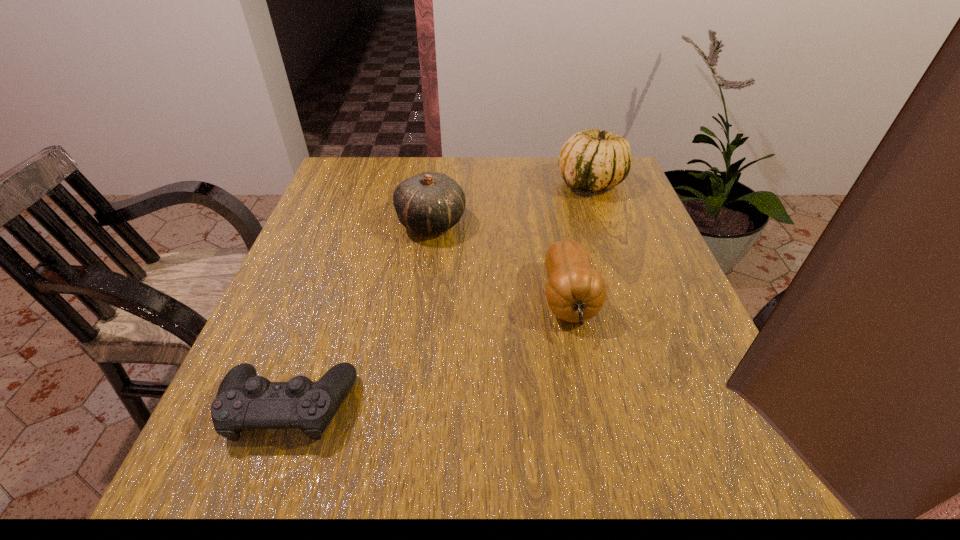
This screenshot has width=960, height=540. I want to click on the farthest object, so click(x=591, y=160).

Where is `the third nearest object`? The width and height of the screenshot is (960, 540). the third nearest object is located at coordinates (430, 202).

At what (x,y) coordinates should I click in order to perform the action: click on the third object from right to left. Please return your answer as a coordinate pair (x, y). Looking at the image, I should click on (430, 202).

Identify the location of the nearest gourd. The height and width of the screenshot is (540, 960). (575, 292).

Locate an element on the screen. This screenshot has height=540, width=960. the nearest object is located at coordinates (244, 400).

This screenshot has height=540, width=960. In order to click on the leftmost object in this screenshot , I will do tap(244, 400).

Image resolution: width=960 pixels, height=540 pixels. In order to click on free space located on the front of the farthest object in this screenshot , I will do `click(636, 312)`.

What are the coordinates of `vacant space situated on the front of the second farthest gourd` in the screenshot? It's located at (424, 278).

The width and height of the screenshot is (960, 540). Find the location of `vacant space situated 0.240m on the stem side of the third farthest object`. vacant space situated 0.240m on the stem side of the third farthest object is located at coordinates (605, 480).

Image resolution: width=960 pixels, height=540 pixels. I want to click on vacant space situated on the right of the control, so click(518, 407).